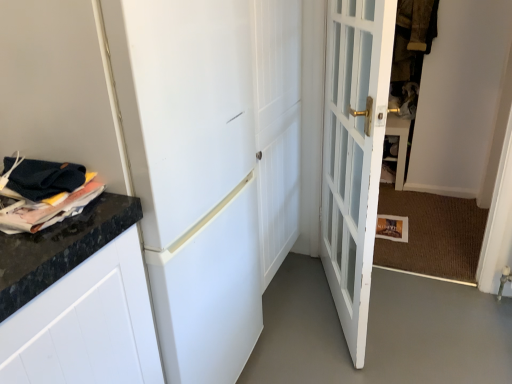
Question: From the image's perspective, is white glass door at center, which is the 2th door in left-to-right order, under brown textured fabric at upper right?

Choices:
 (A) no
 (B) yes

Answer: (B)

Question: Does white glass door at center, which is the 2th door in left-to-right order, contain brown textured fabric at upper right?

Choices:
 (A) yes
 (B) no

Answer: (B)

Question: Is white glass door at center, acting as the 1th door starting from the right, not close to brown textured fabric at upper right?

Choices:
 (A) no
 (B) yes

Answer: (B)

Question: Does white glass door at center, which is the 2th door in left-to-right order, have a larger size compared to brown textured fabric at upper right?

Choices:
 (A) yes
 (B) no

Answer: (A)

Question: Is white glass door at center, acting as the 1th door starting from the right, shorter than brown textured fabric at upper right?

Choices:
 (A) yes
 (B) no

Answer: (B)

Question: Is white glass door at center, acting as the 1th door starting from the right, taller or shorter than matte black magazine at left?

Choices:
 (A) short
 (B) tall

Answer: (B)

Question: Do you think white glass door at center, acting as the 1th door starting from the right, is within matte black magazine at left, or outside of it?

Choices:
 (A) inside
 (B) outside

Answer: (B)

Question: Considering the positions of white glass door at center, which is the 2th door in left-to-right order, and matte black magazine at left in the image, is white glass door at center, which is the 2th door in left-to-right order, wider or thinner than matte black magazine at left?

Choices:
 (A) thin
 (B) wide

Answer: (A)

Question: From the image's perspective, is white glass door at center, acting as the 1th door starting from the right, above or below matte black magazine at left?

Choices:
 (A) below
 (B) above

Answer: (B)

Question: Considering the positions of white glossy door at center, which is counted as the second door, starting from the right, and brown textured fabric at upper right in the image, is white glossy door at center, which is counted as the second door, starting from the right, taller or shorter than brown textured fabric at upper right?

Choices:
 (A) tall
 (B) short

Answer: (A)

Question: Would you say white glossy door at center, positioned as the 1th door in left-to-right order, is inside or outside brown textured fabric at upper right?

Choices:
 (A) outside
 (B) inside

Answer: (A)

Question: From a real-world perspective, is white glossy door at center, which is counted as the second door, starting from the right, positioned above or below brown textured fabric at upper right?

Choices:
 (A) above
 (B) below

Answer: (B)

Question: Does point (236, 21) appear closer or farther from the camera than point (410, 54)?

Choices:
 (A) closer
 (B) farther

Answer: (A)

Question: Would you say white glossy door at center, which is counted as the second door, starting from the right, is to the left or to the right of matte black magazine at left in the picture?

Choices:
 (A) left
 (B) right

Answer: (B)

Question: Considering the positions of white glossy door at center, positioned as the 1th door in left-to-right order, and matte black magazine at left in the image, is white glossy door at center, positioned as the 1th door in left-to-right order, taller or shorter than matte black magazine at left?

Choices:
 (A) short
 (B) tall

Answer: (B)